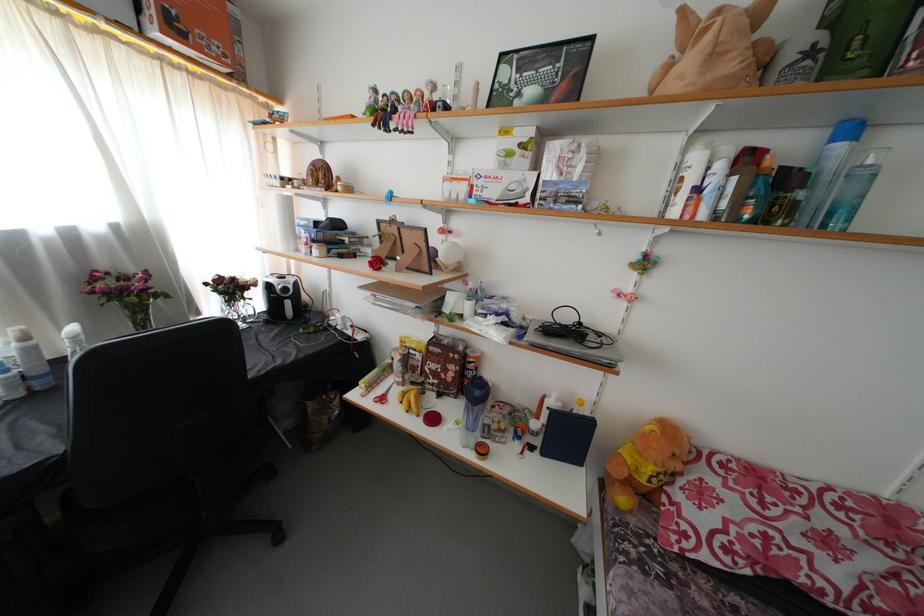
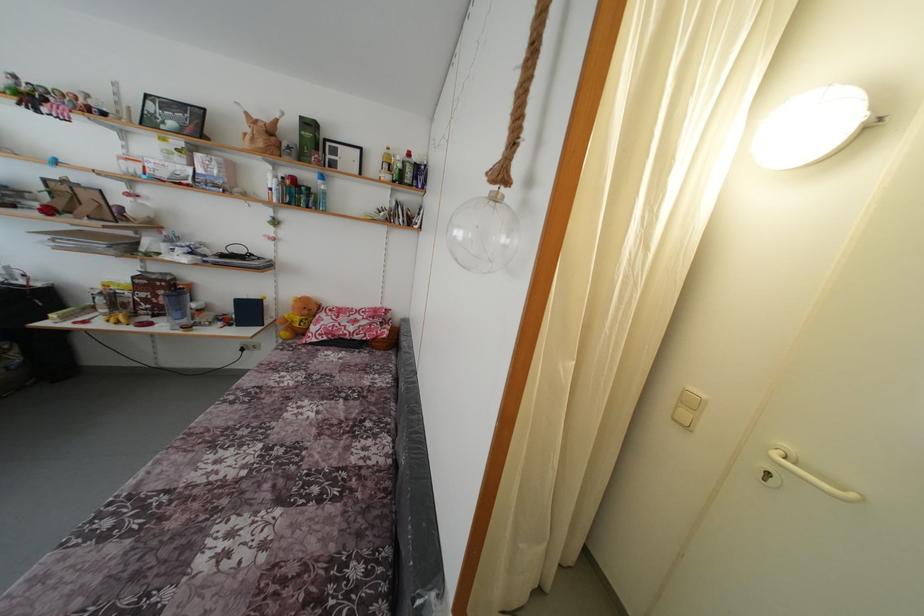
Locate, in the second image, the point that corresponds to pixel 732 492 in the first image.

(332, 321)